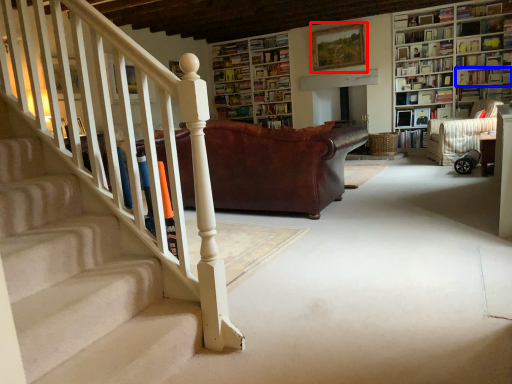
Question: Which point is further to the camera, picture frame (highlighted by a red box) or book (highlighted by a blue box)?

Choices:
 (A) picture frame
 (B) book

Answer: (A)